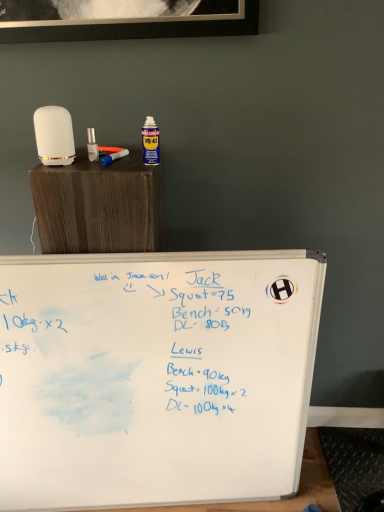
Question: Is the position of whiteboard at lower center less distant than that of blue plastic paint brush at upper left?

Choices:
 (A) no
 (B) yes

Answer: (A)

Question: Is whiteboard at lower center with blue plastic paint brush at upper left?

Choices:
 (A) yes
 (B) no

Answer: (B)

Question: From a real-world perspective, does whiteboard at lower center sit lower than blue plastic paint brush at upper left?

Choices:
 (A) yes
 (B) no

Answer: (A)

Question: Does whiteboard at lower center appear on the right side of blue plastic paint brush at upper left?

Choices:
 (A) yes
 (B) no

Answer: (A)

Question: From a real-world perspective, is whiteboard at lower center positioned over blue plastic paint brush at upper left based on gravity?

Choices:
 (A) yes
 (B) no

Answer: (B)

Question: Is whiteboard at lower center not near blue plastic paint brush at upper left?

Choices:
 (A) no
 (B) yes

Answer: (B)

Question: Could you tell me if blue plastic paint brush at upper left is turned towards whiteboard at lower center?

Choices:
 (A) no
 (B) yes

Answer: (A)

Question: Is blue plastic paint brush at upper left to the right of whiteboard at lower center from the viewer's perspective?

Choices:
 (A) yes
 (B) no

Answer: (B)

Question: Is blue plastic paint brush at upper left far from whiteboard at lower center?

Choices:
 (A) yes
 (B) no

Answer: (A)

Question: Is blue plastic paint brush at upper left completely or partially outside of whiteboard at lower center?

Choices:
 (A) yes
 (B) no

Answer: (A)

Question: From a real-world perspective, is blue plastic paint brush at upper left positioned under whiteboard at lower center based on gravity?

Choices:
 (A) no
 (B) yes

Answer: (A)

Question: Considering the relative sizes of blue plastic paint brush at upper left and whiteboard at lower center in the image provided, is blue plastic paint brush at upper left thinner than whiteboard at lower center?

Choices:
 (A) no
 (B) yes

Answer: (B)

Question: Is point (125, 148) closer or farther from the camera than point (201, 505)?

Choices:
 (A) farther
 (B) closer

Answer: (B)